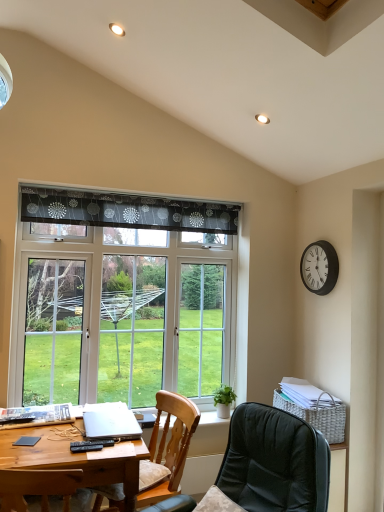
Question: Considering the positions of white wicker picnic basket at lower right and black metal clock at upper right in the image, is white wicker picnic basket at lower right wider or thinner than black metal clock at upper right?

Choices:
 (A) wide
 (B) thin

Answer: (A)

Question: From their relative heights in the image, would you say white wicker picnic basket at lower right is taller or shorter than black metal clock at upper right?

Choices:
 (A) short
 (B) tall

Answer: (A)

Question: Based on their relative distances, which object is farther from the transparent glass window at center?

Choices:
 (A) white wicker picnic basket at lower right
 (B) black metal clock at upper right
 (C) wooden desk at lower left
 (D) wooden chair at lower left, the 1th chair when ordered from back to front
 (E) black plastic remote control at lower left, the first remote control from the front

Answer: (E)

Question: Which of these objects is positioned farthest from the white wicker picnic basket at lower right?

Choices:
 (A) black plastic remote control at lower left, the first remote control from the front
 (B) silver metallic laptop at lower left
 (C) leather-like black chair at lower center, placed as the 2th chair when sorted from back to front
 (D) black plastic remote control at lower left, which is the 1th remote control from back to front
 (E) wooden chair at lower left, the 1th chair when ordered from back to front

Answer: (D)